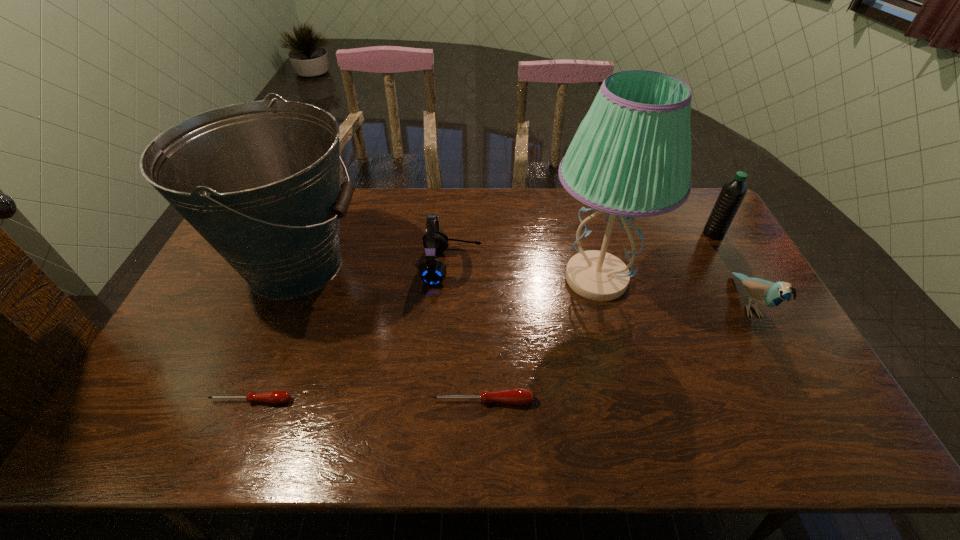
The width and height of the screenshot is (960, 540). I want to click on blank region between the shortest object and the bird, so click(x=499, y=353).

This screenshot has width=960, height=540. I want to click on vacant point located between the shorter screwdriver and the water bottle, so [x=482, y=317].

Identify the location of empty space between the taller screwdriver and the headset. The width and height of the screenshot is (960, 540). (468, 333).

Image resolution: width=960 pixels, height=540 pixels. I want to click on vacant point located between the shortest object and the sixth tallest object, so click(x=367, y=401).

In order to click on free point between the bird and the taller screwdriver in this screenshot , I will do `click(615, 353)`.

Find the location of a particular element. The height and width of the screenshot is (540, 960). empty space that is in between the bird and the water bottle is located at coordinates (731, 269).

I want to click on unoccupied area between the bucket and the bird, so (521, 285).

Choose which object is the fifth nearest neighbor to the water bottle. Please provide its 2D coordinates. Your answer should be formatted as a tuple, i.e. [(x, y)], where the tuple contains the x and y coordinates of a point satisfying the conditions above.

[(260, 181)]

I want to click on object identified as the closest to the third object from right to left, so click(432, 271).

Locate an element on the screen. vacant space that satisfies the following two spatial constraints: 1. on the ear cushions of the headset; 2. on the back side of the taller screwdriver is located at coordinates (444, 401).